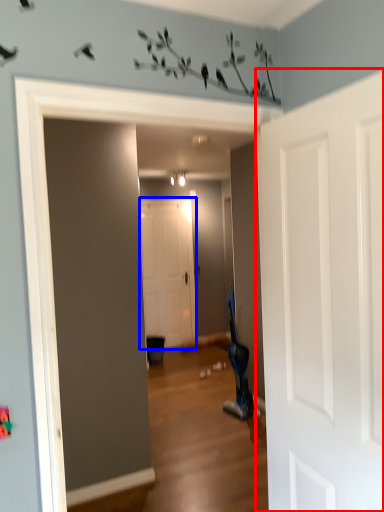
Question: Among these objects, which one is farthest to the camera, door (highlighted by a red box) or door (highlighted by a blue box)?

Choices:
 (A) door
 (B) door

Answer: (B)